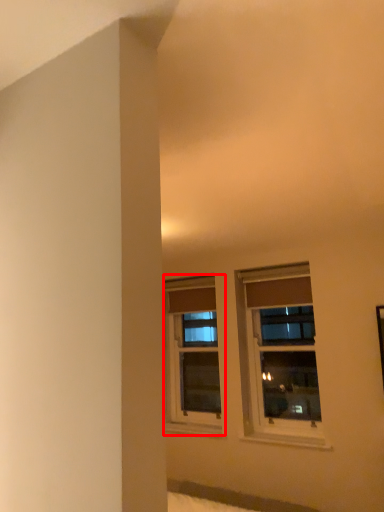
Question: Where is window (annotated by the red box) located in relation to window in the image?

Choices:
 (A) left
 (B) right

Answer: (A)